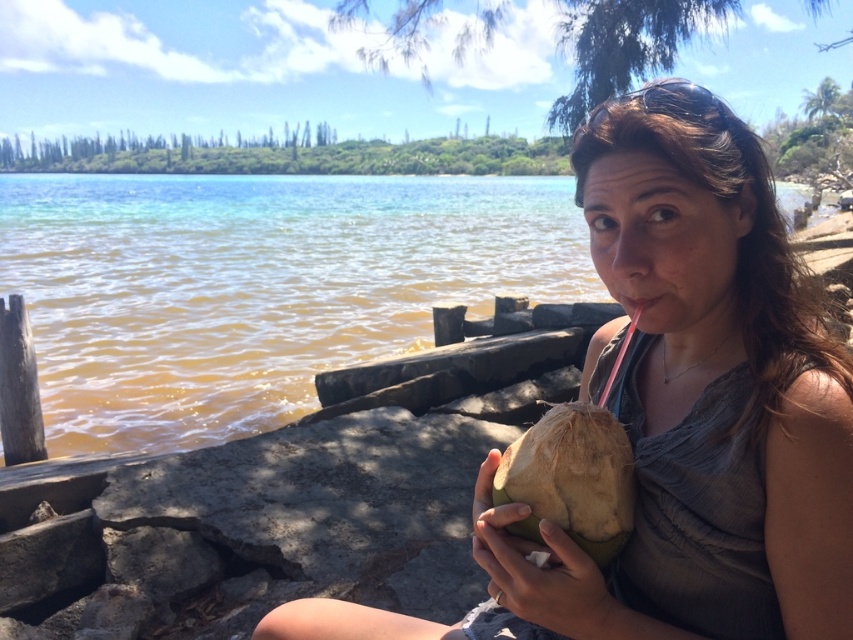
Question: Which object is closer to the camera taking this photo?

Choices:
 (A) green rough coconut at center
 (B) clear water at center

Answer: (A)

Question: Does clear water at center have a larger size compared to green rough coconut at lower center?

Choices:
 (A) no
 (B) yes

Answer: (B)

Question: Which point is farther to the camera?

Choices:
 (A) green rough coconut at lower center
 (B) green rough coconut at center
 (C) clear water at center

Answer: (C)

Question: Does green rough coconut at center come behind green rough coconut at lower center?

Choices:
 (A) no
 (B) yes

Answer: (A)

Question: Which object appears closest to the camera in this image?

Choices:
 (A) clear water at center
 (B) brown rough coconut at lower center
 (C) green rough coconut at lower center
 (D) green rough coconut at center

Answer: (D)

Question: In this image, where is green rough coconut at center located relative to brown rough coconut at lower center?

Choices:
 (A) right
 (B) left

Answer: (B)